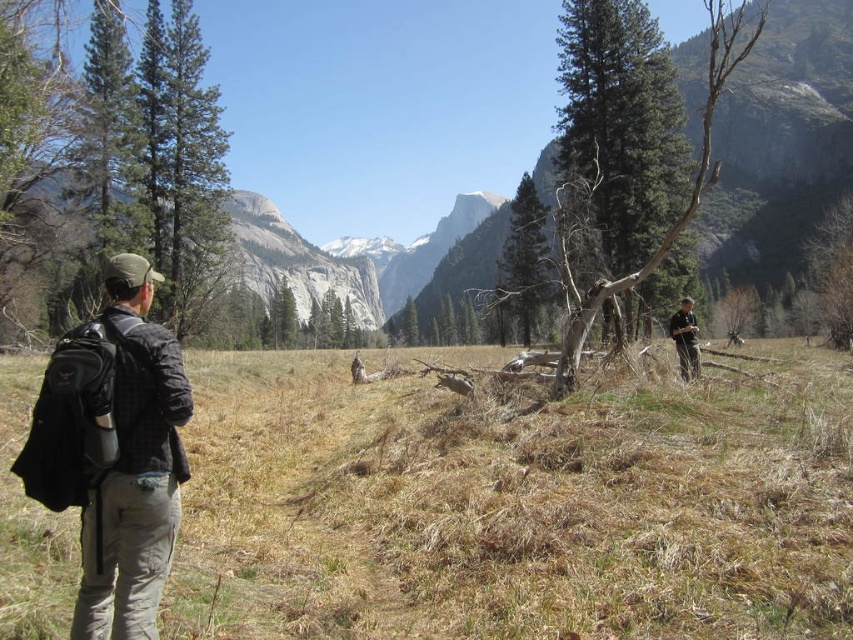
Does brown grass at center have a greater height compared to black fabric backpack at left?

Incorrect, brown grass at center's height is not larger of black fabric backpack at left's.

Can you confirm if brown grass at center is positioned to the left of black fabric backpack at left?

No, brown grass at center is not to the left of black fabric backpack at left.

Which is behind, point (795, 474) or point (169, 486)?

Positioned behind is point (795, 474).

Identify the location of brown grass at center. (515, 506).

Is point (639, 100) closer to viewer compared to point (682, 369)?

No, (639, 100) is behind (682, 369).

From the picture: Who is positioned more to the left, green textured pine tree at center or dark brown leather jacket at right?

green textured pine tree at center

Identify the location of green textured pine tree at center. (621, 125).

Which of these two, brown grass at center or dark brown leather jacket at right, stands shorter?

Standing shorter between the two is dark brown leather jacket at right.

What do you see at coordinates (515, 506) in the screenshot? I see `brown grass at center` at bounding box center [515, 506].

I want to click on brown grass at center, so click(x=515, y=506).

Where is `brown grass at center`? brown grass at center is located at coordinates (515, 506).